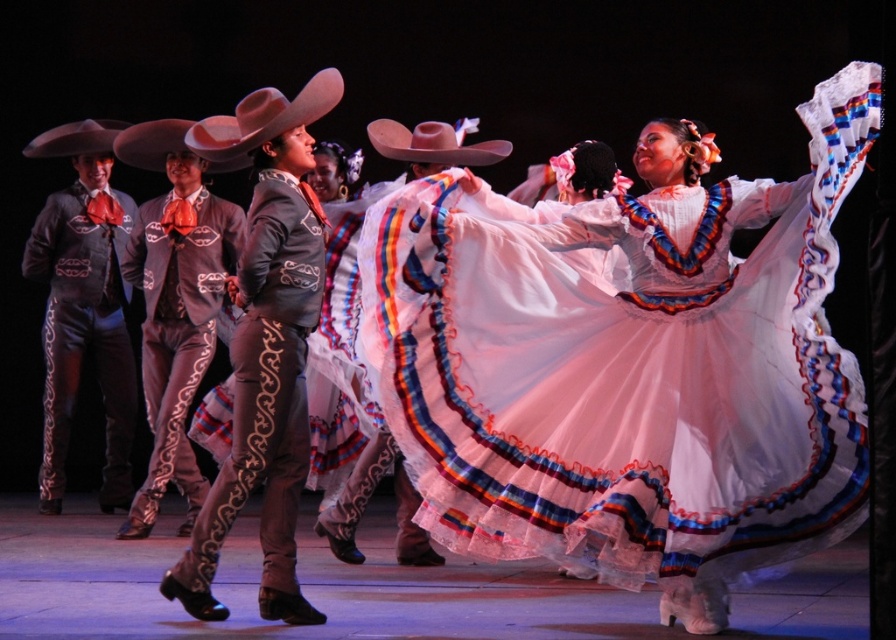
Question: Which of the following is the closest to the observer?

Choices:
 (A) gray satin suit at center
 (B) pink felt cowboy hat at center
 (C) matte black suit at left
 (D) matte pink cowboy hat at center

Answer: (D)

Question: Does matte gray suit at center appear on the left side of matte pink cowboy hat at center?

Choices:
 (A) yes
 (B) no

Answer: (B)

Question: From the image, what is the correct spatial relationship of gray suede suit at center in relation to matte pink cowboy hat at center?

Choices:
 (A) left
 (B) right

Answer: (B)

Question: Which of these objects is positioned closest to the pink felt cowboy hat at center?

Choices:
 (A) white satin dress at center
 (B) gray satin suit at center
 (C) matte gray suit at center
 (D) matte black suit at left

Answer: (B)

Question: Considering the relative positions of gray satin suit at center and matte pink cowboy hat at center in the image provided, where is gray satin suit at center located with respect to matte pink cowboy hat at center?

Choices:
 (A) right
 (B) left

Answer: (B)

Question: Which of the following is the closest to the observer?

Choices:
 (A) (71, 125)
 (B) (222, 134)
 (C) (368, 493)
 (D) (378, 118)

Answer: (B)